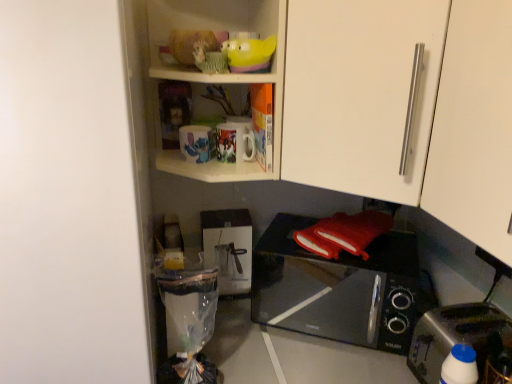
Question: Is matte ceramic mugs at upper center placed right next to black glossy microwave oven at lower center?

Choices:
 (A) yes
 (B) no

Answer: (B)

Question: Can you confirm if matte ceramic mugs at upper center is bigger than black glossy microwave oven at lower center?

Choices:
 (A) yes
 (B) no

Answer: (B)

Question: Is black glossy microwave oven at lower center inside matte ceramic mugs at upper center?

Choices:
 (A) yes
 (B) no

Answer: (B)

Question: From a real-world perspective, does matte ceramic mugs at upper center sit lower than black glossy microwave oven at lower center?

Choices:
 (A) yes
 (B) no

Answer: (B)

Question: Considering the relative positions of matte ceramic mugs at upper center and black glossy microwave oven at lower center in the image provided, is matte ceramic mugs at upper center to the left of black glossy microwave oven at lower center from the viewer's perspective?

Choices:
 (A) no
 (B) yes

Answer: (B)

Question: Looking at their shapes, would you say translucent yellow bowl at upper center is wider or thinner than white plastic bottle at lower right?

Choices:
 (A) wide
 (B) thin

Answer: (A)

Question: From a real-world perspective, relative to white plastic bottle at lower right, is translucent yellow bowl at upper center vertically above or below?

Choices:
 (A) above
 (B) below

Answer: (A)

Question: Choose the correct answer: Is translucent yellow bowl at upper center inside white plastic bottle at lower right or outside it?

Choices:
 (A) inside
 (B) outside

Answer: (B)

Question: Looking at the image, does translucent yellow bowl at upper center seem bigger or smaller compared to white plastic bottle at lower right?

Choices:
 (A) small
 (B) big

Answer: (A)

Question: In terms of width, does black glossy microwave oven at lower center look wider or thinner when compared to white matte cabinet door at upper right, which is the 1th cabinetry from back to front?

Choices:
 (A) wide
 (B) thin

Answer: (B)

Question: Visually, is black glossy microwave oven at lower center positioned to the left or to the right of white matte cabinet door at upper right, which is the 1th cabinetry from back to front?

Choices:
 (A) right
 (B) left

Answer: (B)

Question: Is black glossy microwave oven at lower center inside the boundaries of white matte cabinet door at upper right, which is the 2th cabinetry in front-to-back order, or outside?

Choices:
 (A) outside
 (B) inside

Answer: (A)

Question: From a real-world perspective, is black glossy microwave oven at lower center positioned above or below white matte cabinet door at upper right, which is the 2th cabinetry in front-to-back order?

Choices:
 (A) below
 (B) above

Answer: (A)

Question: From the image's perspective, is white matte cabinet door at upper right, which is the 1th cabinetry from back to front, positioned above or below black glossy microwave oven at lower center?

Choices:
 (A) above
 (B) below

Answer: (A)

Question: Is white matte cabinet door at upper right, which is the 2th cabinetry in front-to-back order, in front of or behind black glossy microwave oven at lower center in the image?

Choices:
 (A) behind
 (B) front

Answer: (B)